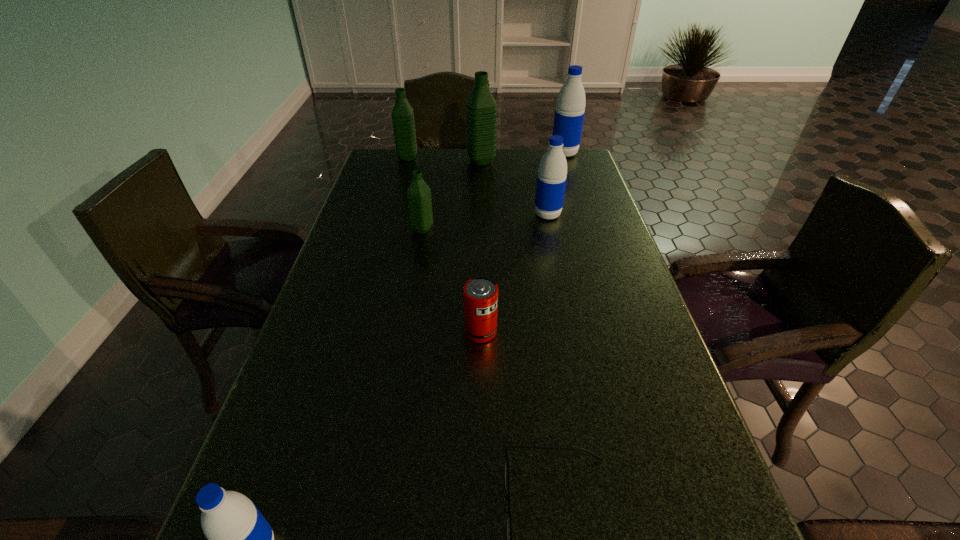
In the image, there is a desktop. What are the coordinates of `vacant space at the far edge` in the screenshot? It's located at (421, 155).

The width and height of the screenshot is (960, 540). What are the coordinates of `free region at the left edge of the desktop` in the screenshot? It's located at (340, 266).

I want to click on vacant space at the right edge of the desktop, so click(x=628, y=330).

In the image, there is a desktop. Where is `vacant region at the far left corner`? This screenshot has width=960, height=540. vacant region at the far left corner is located at coordinates (372, 174).

Where is `empty location between the nearest green water bottle and the second smallest blue water bottle`? This screenshot has height=540, width=960. empty location between the nearest green water bottle and the second smallest blue water bottle is located at coordinates (485, 222).

Find the location of `free space between the sixth object from right to left and the rightmost green water bottle`. free space between the sixth object from right to left and the rightmost green water bottle is located at coordinates (451, 195).

I want to click on vacant area that lies between the fourth farthest water bottle and the third water bottle from right to left, so click(515, 188).

You are a GUI agent. You are given a task and a screenshot of the screen. Output one action in this format:
    pyautogui.click(x=<x>, y=<y>)
    Task: Click on the free spot between the second smallest green water bottle and the third water bottle from right to left
    The image size is (960, 540).
    Given the screenshot: What is the action you would take?
    pyautogui.click(x=444, y=159)

You are a GUI agent. You are given a task and a screenshot of the screen. Output one action in this format:
    pyautogui.click(x=<x>, y=<y>)
    Task: Click on the vacant space that's between the rightmost blue water bottle and the biggest green water bottle
    This screenshot has height=540, width=960.
    Given the screenshot: What is the action you would take?
    pyautogui.click(x=522, y=158)

Where is `object that is the sixth closest one to the second biggest green water bottle`? object that is the sixth closest one to the second biggest green water bottle is located at coordinates (509, 530).